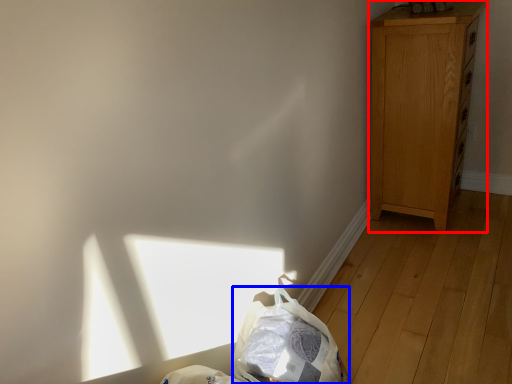
Question: Among these objects, which one is nearest to the camera, dresser (highlighted by a red box) or diaper bag (highlighted by a blue box)?

Choices:
 (A) dresser
 (B) diaper bag

Answer: (B)